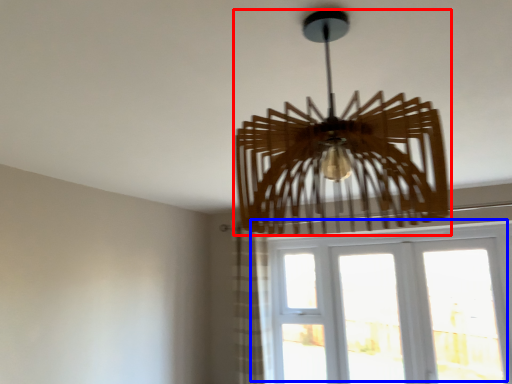
Question: Among these objects, which one is farthest to the camera, lamp (highlighted by a red box) or window (highlighted by a blue box)?

Choices:
 (A) lamp
 (B) window

Answer: (B)